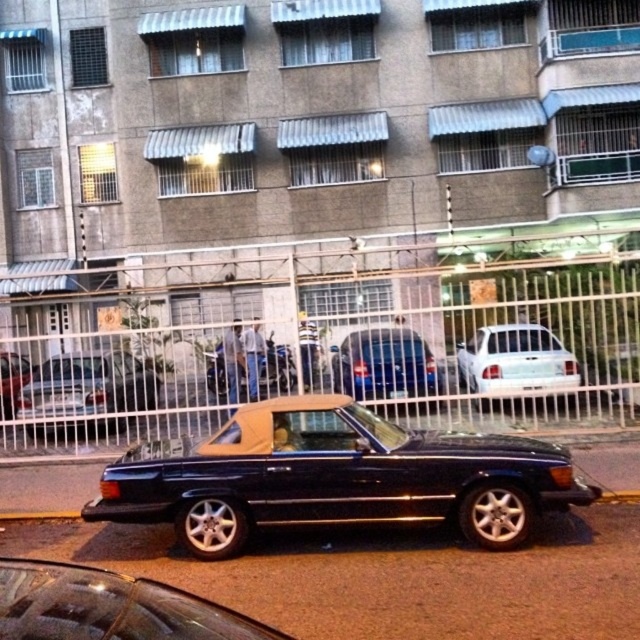
You are a delivery person with a 35 feet long truck. You need to park your truck between the metallic silver fence at center and the camera. Is there enough space?

The distance between the metallic silver fence at center and the camera is 34.65 feet, which is slightly shorter than your 35 feet long truck. Therefore, the space is insufficient for parking the truck between them.

You are a delivery person trying to navigate through the street. There is a metallic silver fence at center. Can you pass through the fence at point (346, 356)?

The metallic silver fence at center is represented by point (346, 356), so you cannot pass through it as it is a fence.

You are a delivery driver who needs to park your blue metallic van at center in a parking spot that can only accommodate vehicles shorter than the shiny black convertible at lower left. Can you park your van there?

The shiny black convertible at lower left is shorter than the blue metallic van at center, so the parking spot cannot accommodate the blue metallic van at center since it is longer than the allowed length.